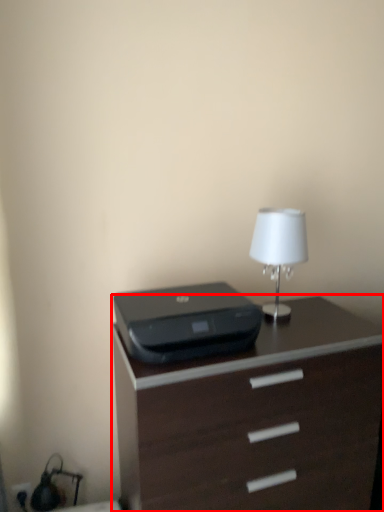
Question: Considering the relative positions of chest of drawers (annotated by the red box) and printer in the image provided, where is chest of drawers (annotated by the red box) located with respect to the staircase?

Choices:
 (A) right
 (B) left

Answer: (A)